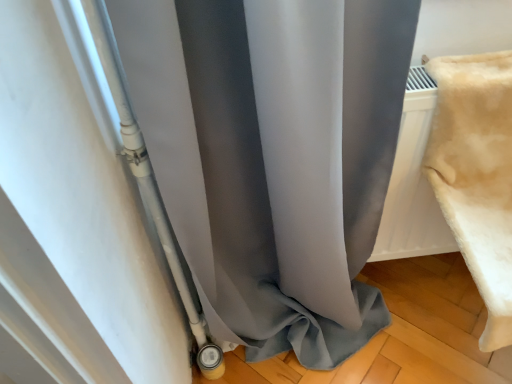
Question: Can you confirm if beige plush blanket at right is bigger than matte gray curtain at center?

Choices:
 (A) no
 (B) yes

Answer: (A)

Question: Does beige plush blanket at right appear on the right side of matte gray curtain at center?

Choices:
 (A) no
 (B) yes

Answer: (B)

Question: From the image's perspective, is beige plush blanket at right over matte gray curtain at center?

Choices:
 (A) no
 (B) yes

Answer: (B)

Question: Are beige plush blanket at right and matte gray curtain at center far apart?

Choices:
 (A) no
 (B) yes

Answer: (A)

Question: Would you say matte gray curtain at center is part of beige plush blanket at right's contents?

Choices:
 (A) yes
 (B) no

Answer: (B)

Question: Is the position of beige plush blanket at right less distant than that of matte gray curtain at center?

Choices:
 (A) no
 (B) yes

Answer: (A)

Question: From the image's perspective, is matte gray curtain at center on beige plush blanket at right?

Choices:
 (A) yes
 (B) no

Answer: (B)

Question: Is matte gray curtain at center looking in the opposite direction of beige plush blanket at right?

Choices:
 (A) no
 (B) yes

Answer: (A)

Question: Could you tell me if matte gray curtain at center is facing beige plush blanket at right?

Choices:
 (A) no
 (B) yes

Answer: (A)

Question: Does matte gray curtain at center appear on the left side of beige plush blanket at right?

Choices:
 (A) no
 (B) yes

Answer: (B)

Question: Is matte gray curtain at center taller than beige plush blanket at right?

Choices:
 (A) yes
 (B) no

Answer: (A)

Question: Can you confirm if matte gray curtain at center is bigger than beige plush blanket at right?

Choices:
 (A) no
 (B) yes

Answer: (B)

Question: Is beige plush blanket at right taller or shorter than matte gray curtain at center?

Choices:
 (A) tall
 (B) short

Answer: (B)